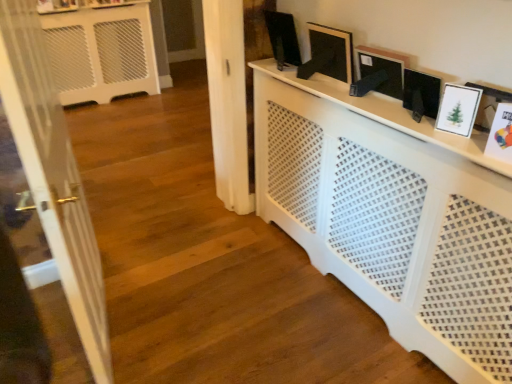
Question: Would you say matte black picture frame at upper center, acting as the 1th picture frame starting from the back, is inside or outside white glossy picture frame at upper right, which is the fourth picture frame in back-to-front order?

Choices:
 (A) inside
 (B) outside

Answer: (B)

Question: Looking at their shapes, would you say matte black picture frame at upper center, acting as the 1th picture frame starting from the back, is wider or thinner than white glossy picture frame at upper right, which is the fourth picture frame in back-to-front order?

Choices:
 (A) wide
 (B) thin

Answer: (A)

Question: Estimate the real-world distances between objects in this image. Which object is farther from the matte black picture frame at upper center, placed as the fifth picture frame when sorted from right to left?

Choices:
 (A) white perforated radiator at center
 (B) white paper picture frame at right, which is counted as the fifth picture frame, starting from the left
 (C) white glossy door at left
 (D) white glossy picture frame at upper right, which is counted as the second picture frame, starting from the right
 (E) white matte picture frame at upper right, which is the 3th picture frame in left-to-right order

Answer: (C)

Question: Which object is positioned closest to the matte black picture frame at upper center, placed as the fifth picture frame when sorted from right to left?

Choices:
 (A) black matte picture frame at upper center, which is counted as the 4th picture frame, starting from the front
 (B) white matte picture frame at upper right, which is the 3th picture frame in left-to-right order
 (C) white glossy picture frame at upper right, the 4th picture frame from the left
 (D) white paper picture frame at right, positioned as the first picture frame in right-to-left order
 (E) white glossy door at left

Answer: (A)